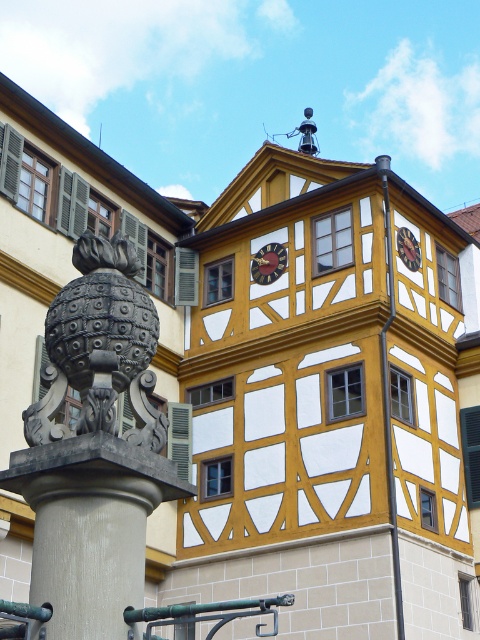
You are an architect designing a miniature model of this building. You need to ensure the smooth gray stone column at lower left and wooden clock at center are proportionally accurate. Which object should be taller in your model?

The smooth gray stone column at lower left should be taller in the model since it has a greater height compared to the wooden clock at center.

You are an architect designing a miniature model of this building. You have a limited amount of material for the smooth gray stone column at lower left and the wooden clock at center. Which object requires more material based on their widths?

The smooth gray stone column at lower left requires more material because its width is larger than the wooden clock at center.